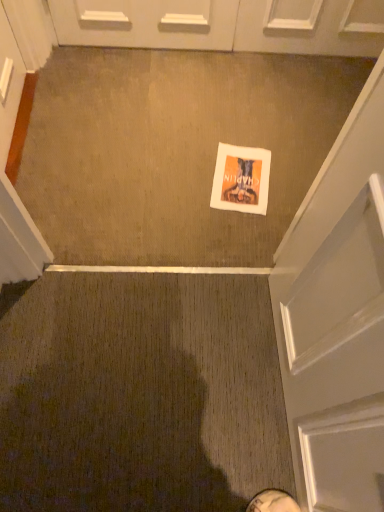
Where is `free spot to the left of white paper flyer at center`? Image resolution: width=384 pixels, height=512 pixels. free spot to the left of white paper flyer at center is located at coordinates (176, 184).